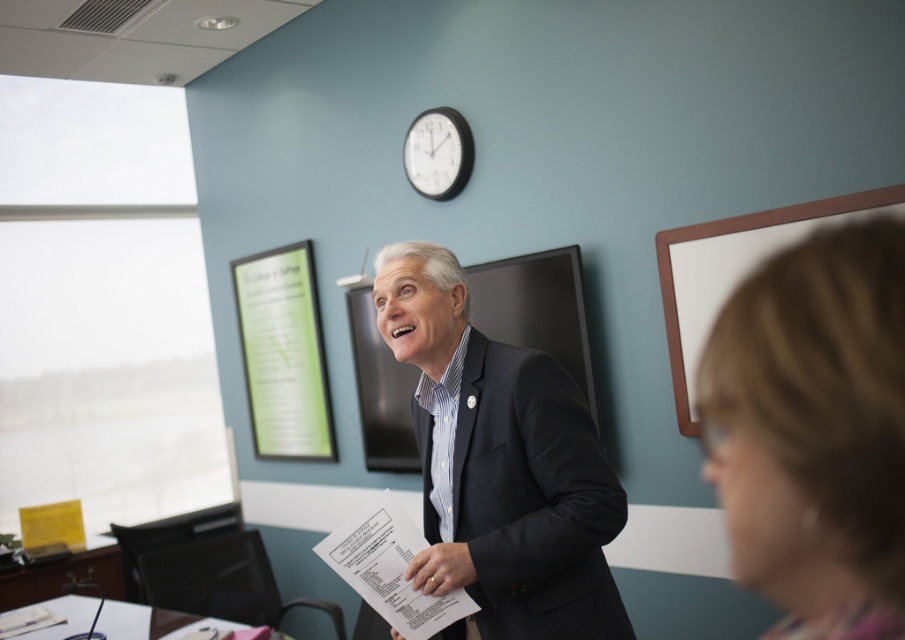
Can you confirm if blonde hair at lower right is shorter than white matte board at upper right?

Correct, blonde hair at lower right is not as tall as white matte board at upper right.

Is point (748, 403) positioned after point (688, 275)?

No, it is in front of (688, 275).

The width and height of the screenshot is (905, 640). What do you see at coordinates (814, 432) in the screenshot?
I see `blonde hair at lower right` at bounding box center [814, 432].

This screenshot has width=905, height=640. In order to click on blonde hair at lower right in this screenshot , I will do `click(814, 432)`.

Between blonde hair at lower right and dark gray suit at center, which one appears on the left side from the viewer's perspective?

Positioned to the left is dark gray suit at center.

Where is `blonde hair at lower right`? The image size is (905, 640). blonde hair at lower right is located at coordinates (814, 432).

Where is `blonde hair at lower right`? This screenshot has height=640, width=905. blonde hair at lower right is located at coordinates (814, 432).

Between point (380, 268) and point (452, 134), which one is positioned in front?

Point (380, 268)

Does dark gray suit at center appear on the left side of white glossy clock at upper center?

In fact, dark gray suit at center is to the right of white glossy clock at upper center.

Measure the distance between point (470, 346) and camera.

1.59 meters

This screenshot has width=905, height=640. Find the location of `dark gray suit at center`. dark gray suit at center is located at coordinates (500, 465).